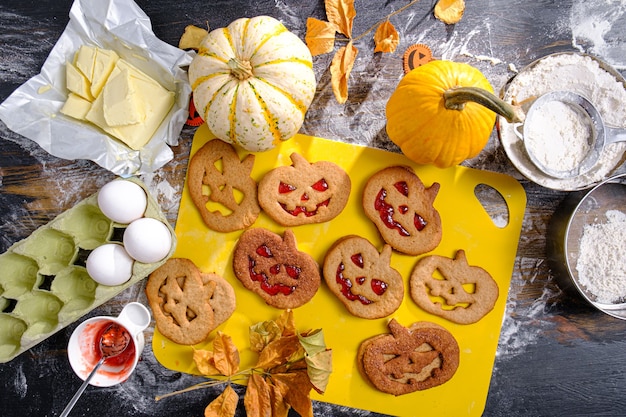
Find the location of a particular element. The height and width of the screenshot is (417, 626). metal sppon is located at coordinates tap(91, 371).